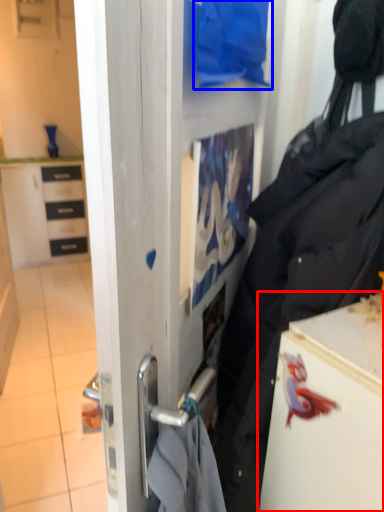
Question: Which object appears closest to the camera in this image, fridge (highlighted by a red box) or clothing (highlighted by a blue box)?

Choices:
 (A) fridge
 (B) clothing

Answer: (A)